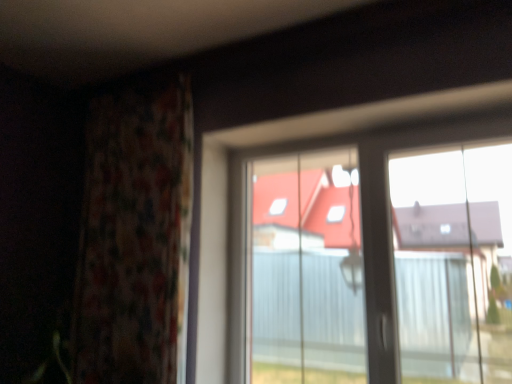
Question: Does transparent plastic window at center have a smaller size compared to floral fabric curtain at left?

Choices:
 (A) no
 (B) yes

Answer: (B)

Question: Is transparent plastic window at center not within floral fabric curtain at left?

Choices:
 (A) no
 (B) yes

Answer: (B)

Question: Can you confirm if transparent plastic window at center is wider than floral fabric curtain at left?

Choices:
 (A) no
 (B) yes

Answer: (A)

Question: From a real-world perspective, is transparent plastic window at center over floral fabric curtain at left?

Choices:
 (A) no
 (B) yes

Answer: (A)

Question: Is the position of transparent plastic window at center more distant than that of floral fabric curtain at left?

Choices:
 (A) yes
 (B) no

Answer: (B)

Question: From the image's perspective, does transparent plastic window at center appear higher than floral fabric curtain at left?

Choices:
 (A) no
 (B) yes

Answer: (A)

Question: Can you confirm if floral fabric curtain at left is thinner than transparent plastic window at center?

Choices:
 (A) no
 (B) yes

Answer: (A)

Question: Is floral fabric curtain at left in contact with transparent plastic window at center?

Choices:
 (A) no
 (B) yes

Answer: (A)

Question: Is floral fabric curtain at left turned away from transparent plastic window at center?

Choices:
 (A) yes
 (B) no

Answer: (B)

Question: Considering the relative positions of floral fabric curtain at left and transparent plastic window at center in the image provided, is floral fabric curtain at left to the right of transparent plastic window at center from the viewer's perspective?

Choices:
 (A) yes
 (B) no

Answer: (B)

Question: Can you confirm if floral fabric curtain at left is bigger than transparent plastic window at center?

Choices:
 (A) yes
 (B) no

Answer: (A)

Question: Does floral fabric curtain at left have a smaller size compared to transparent plastic window at center?

Choices:
 (A) no
 (B) yes

Answer: (A)

Question: Does point (266, 365) appear closer or farther from the camera than point (108, 178)?

Choices:
 (A) farther
 (B) closer

Answer: (A)